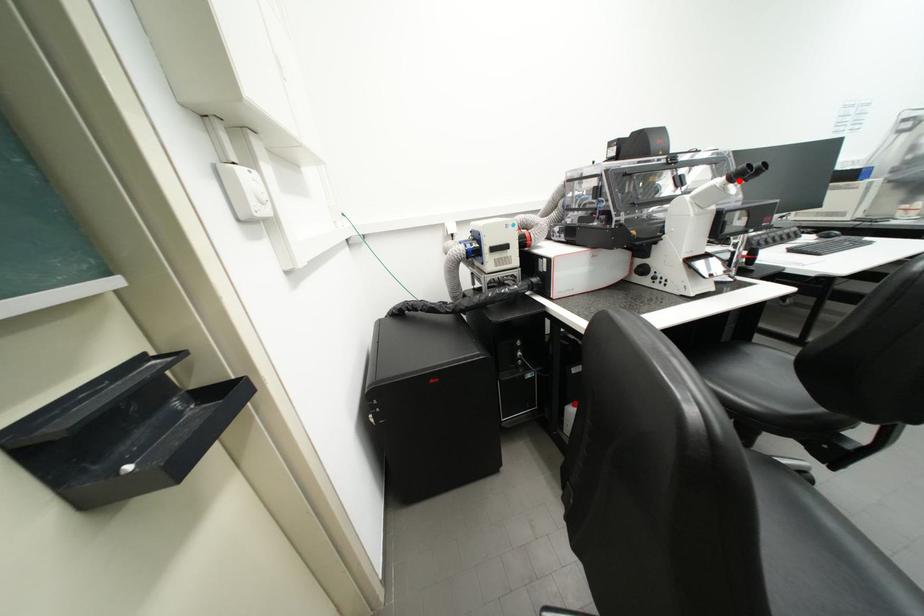
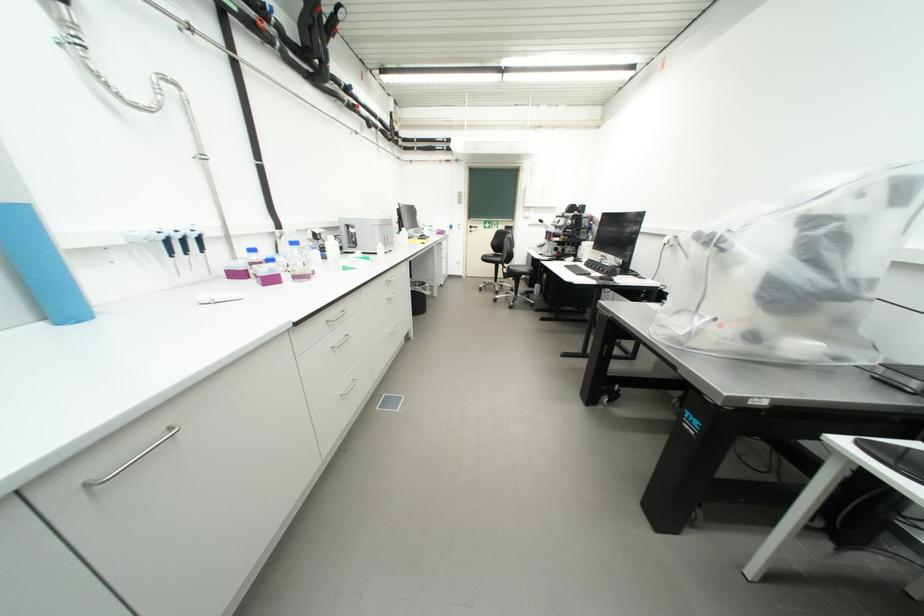
Question: I am providing you with two images of the same scene from different viewpoints. A red point is marked on the first image. Is the red point's position out of view in image 2?

Choices:
 (A) Yes
 (B) No

Answer: (A)